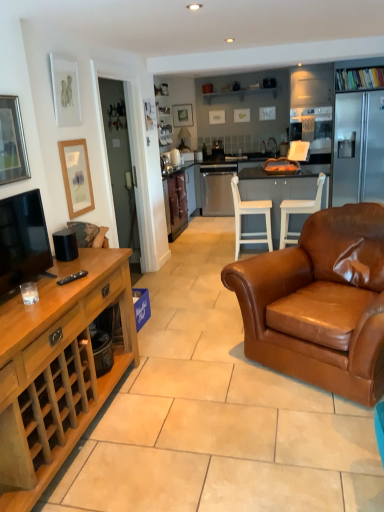
Describe the element at coordinates (12, 142) in the screenshot. Image resolution: width=384 pixels, height=512 pixels. I see `silver-framed picture at upper left, the first picture frame in the left-to-right sequence` at that location.

Find the location of a particular element. matte black picture frame at upper center, the 4th picture frame in the front-to-back sequence is located at coordinates 182,115.

At what (x,y) coordinates should I click in order to perform the action: click on satin silver dishwasher at center. Please return your answer as a coordinate pair (x, y). The height and width of the screenshot is (512, 384). Looking at the image, I should click on (217, 189).

Describe the element at coordinates (298, 213) in the screenshot. I see `brown leather chair at center, placed as the second chair when sorted from left to right` at that location.

Where is `brown leather armchair at center`? Image resolution: width=384 pixels, height=512 pixels. brown leather armchair at center is located at coordinates (320, 302).

Locate an element on the screen. silver-framed picture at upper left, which is counted as the fourth picture frame, starting from the right is located at coordinates (12, 142).

In the image, is silver-framed picture at upper left, which ranks as the third picture frame in top-to-bottom order, positioned in front of or behind brown leather chair at center, the 1th chair when ordered from right to left?

silver-framed picture at upper left, which ranks as the third picture frame in top-to-bottom order, is positioned closer to the viewer than brown leather chair at center, the 1th chair when ordered from right to left.

Is silver-framed picture at upper left, positioned as the second picture frame in bottom-to-top order, surrounding brown leather chair at center, placed as the second chair when sorted from left to right?

Definitely not — brown leather chair at center, placed as the second chair when sorted from left to right, is not inside silver-framed picture at upper left, positioned as the second picture frame in bottom-to-top order.

Locate an element on the screen. This screenshot has height=512, width=384. chair that is the 1st one when counting downward from the silver-framed picture at upper left, positioned as the second picture frame in bottom-to-top order (from the image's perspective) is located at coordinates (298, 213).

How different are the orientations of silver-framed picture at upper left, which is counted as the fourth picture frame, starting from the right, and brown leather chair at center, the 1th chair when ordered from right to left, in degrees?

The facing directions of silver-framed picture at upper left, which is counted as the fourth picture frame, starting from the right, and brown leather chair at center, the 1th chair when ordered from right to left, are 178 degrees apart.

Is matte black tv at left completely or partially outside of satin silver dishwasher at center?

Yes, matte black tv at left is not within satin silver dishwasher at center.

From the image's perspective, is matte black tv at left under satin silver dishwasher at center?

Yes, from the image's perspective, matte black tv at left is below satin silver dishwasher at center.

Does matte black tv at left have a lesser width compared to satin silver dishwasher at center?

Yes, matte black tv at left is thinner than satin silver dishwasher at center.

Looking at this image, is matte black tv at left positioned far away from satin silver dishwasher at center?

Yes, matte black tv at left is far from satin silver dishwasher at center.

Could you tell me if satin silver dishwasher at center is facing matte black picture frame at upper center, the 1th picture frame viewed from the back?

No, satin silver dishwasher at center does not turn towards matte black picture frame at upper center, the 1th picture frame viewed from the back.

Consider the image. Looking at the image, does satin silver dishwasher at center seem bigger or smaller compared to matte black picture frame at upper center, which is counted as the 4th picture frame, starting from the bottom?

In the image, satin silver dishwasher at center appears to be larger than matte black picture frame at upper center, which is counted as the 4th picture frame, starting from the bottom.

Which is correct: satin silver dishwasher at center is inside matte black picture frame at upper center, the 1th picture frame from the top, or outside of it?

satin silver dishwasher at center is not enclosed by matte black picture frame at upper center, the 1th picture frame from the top.

Does point (167, 192) come closer to viewer compared to point (205, 191)?

Yes, it is.

Is brown leather cabinet at center, the 1th cabinetry from the back, positioned beyond the bounds of satin silver dishwasher at center?

Yes, brown leather cabinet at center, the 1th cabinetry from the back, is outside of satin silver dishwasher at center.

Considering the positions of objects brown leather cabinet at center, which is counted as the 2th cabinetry, starting from the bottom, and satin silver dishwasher at center in the image provided, who is more to the right, brown leather cabinet at center, which is counted as the 2th cabinetry, starting from the bottom, or satin silver dishwasher at center?

Positioned to the right is satin silver dishwasher at center.

Does satin silver dishwasher at center turn towards white glossy kettle at center?

No, satin silver dishwasher at center is not aimed at white glossy kettle at center.

Do you think satin silver dishwasher at center is within white glossy kettle at center, or outside of it?

satin silver dishwasher at center exists outside the volume of white glossy kettle at center.

Does satin silver dishwasher at center have a larger size compared to white glossy kettle at center?

Indeed, satin silver dishwasher at center has a larger size compared to white glossy kettle at center.

Is point (218, 167) positioned after point (171, 161)?

Yes, point (218, 167) is farther from viewer.

Which object is positioned more to the left, white glossy kettle at center or satin silver dishwasher at center?

From the viewer's perspective, white glossy kettle at center appears more on the left side.

From a real-world perspective, which object rests below the other?

satin silver dishwasher at center is physically lower.

Considering the sizes of white glossy kettle at center and satin silver dishwasher at center in the image, is white glossy kettle at center bigger or smaller than satin silver dishwasher at center?

Considering their sizes, white glossy kettle at center takes up less space than satin silver dishwasher at center.

Is the surface of matte white picture frame at upper left, the 3th picture frame viewed from the back, in direct contact with brown leather cabinet at center, which appears as the first cabinetry when viewed from the top?

No, matte white picture frame at upper left, the 3th picture frame viewed from the back, is not next to brown leather cabinet at center, which appears as the first cabinetry when viewed from the top.

Which object is closer to the camera, matte white picture frame at upper left, the 2th picture frame positioned from the front, or brown leather cabinet at center, which appears as the first cabinetry when viewed from the top?

matte white picture frame at upper left, the 2th picture frame positioned from the front, is in front.

From a real-world perspective, count 1st cabinetrys downward from the matte white picture frame at upper left, placed as the 3th picture frame when sorted from right to left, and point to it. Please provide its 2D coordinates.

[(178, 199)]

In order to click on the 2nd chair to the right when counting from the silver-framed picture at upper left, positioned as the second picture frame in bottom-to-top order in this screenshot , I will do `click(298, 213)`.

Where is `television below the satin silver dishwasher at center (from the image's perspective)`? Image resolution: width=384 pixels, height=512 pixels. television below the satin silver dishwasher at center (from the image's perspective) is located at coordinates (22, 240).

Looking at the image, which one is located further to matte wooden picture frame at left, the 3th picture frame positioned from the left, silver-framed picture at upper left, which is counted as the fourth picture frame, starting from the right, or matte white picture frame at upper left, positioned as the 3th picture frame in bottom-to-top order?

Based on the image, silver-framed picture at upper left, which is counted as the fourth picture frame, starting from the right, appears to be further to matte wooden picture frame at left, the 3th picture frame positioned from the left.

Considering their positions, is satin silver dishwasher at center positioned closer to brown leather armchair at center than matte black picture frame at upper center, which ranks as the fourth picture frame in left-to-right order?

satin silver dishwasher at center is closer to brown leather armchair at center.

From the image, which object appears to be nearer to white wood chair at center, which is the first chair from left to right, brown leather armchair at center or wooden cabinet at left, arranged as the 1th cabinetry when ordered from the bottom?

The object closer to white wood chair at center, which is the first chair from left to right, is brown leather armchair at center.

Which object lies further to the anchor point white wood chair at center, which is the first chair from left to right, matte white picture frame at upper left, the 3th picture frame viewed from the back, or matte black tv at left?

matte black tv at left.

Estimate the real-world distances between objects in this image. Which object is further from brown leather cabinet at center, the 1th cabinetry from the back, matte black tv at left or brown leather armchair at center?

Among the two, matte black tv at left is located further to brown leather cabinet at center, the 1th cabinetry from the back.

From the image, which object appears to be farther from white wood chair at center, which is the first chair from left to right, matte black tv at left or brown leather chair at center, the 1th chair when ordered from right to left?

matte black tv at left is further to white wood chair at center, which is the first chair from left to right.

Which object lies nearer to the anchor point white glossy kettle at center, matte black picture frame at upper center, which is counted as the 4th picture frame, starting from the bottom, or brown leather chair at center, the 1th chair when ordered from right to left?

Among the two, matte black picture frame at upper center, which is counted as the 4th picture frame, starting from the bottom, is located nearer to white glossy kettle at center.

Looking at the image, which one is located further to wooden cabinet at left, arranged as the 1th cabinetry when ordered from the bottom, white wood table at center or matte black picture frame at upper center, the 1th picture frame viewed from the back?

matte black picture frame at upper center, the 1th picture frame viewed from the back.

In order to click on cabinetry between white wood chair at center, which is the first chair from left to right, and matte black picture frame at upper center, the 4th picture frame in the front-to-back sequence, along the z-axis in this screenshot , I will do `click(178, 199)`.

Image resolution: width=384 pixels, height=512 pixels. I want to click on appliance that lies between matte black picture frame at upper center, the 1th picture frame from the top, and satin silver dishwasher at center from top to bottom, so click(175, 157).

You are a GUI agent. You are given a task and a screenshot of the screen. Output one action in this format:
    pyautogui.click(x=<x>, y=<y>)
    Task: Click on the cabinetry positioned between matte white picture frame at upper left, the 2th picture frame positioned from the front, and matte black picture frame at upper center, the 4th picture frame in the front-to-back sequence, from near to far
    Image resolution: width=384 pixels, height=512 pixels.
    Given the screenshot: What is the action you would take?
    tap(178, 199)

Image resolution: width=384 pixels, height=512 pixels. Identify the location of kitchen appliance between brown leather chair at center, the 1th chair when ordered from right to left, and matte black picture frame at upper center, the 1th picture frame from the top, along the z-axis. (217, 189).